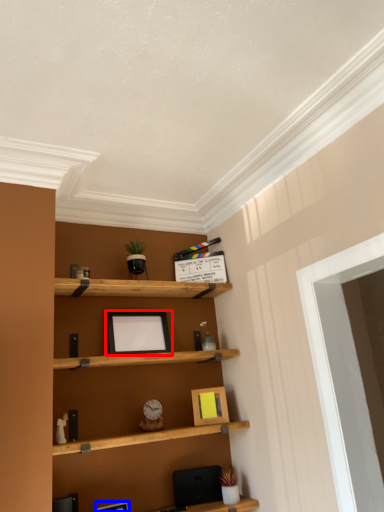
Question: Which object appears farthest to the camera in this image, picture frame (highlighted by a red box) or picture frame (highlighted by a blue box)?

Choices:
 (A) picture frame
 (B) picture frame

Answer: (A)